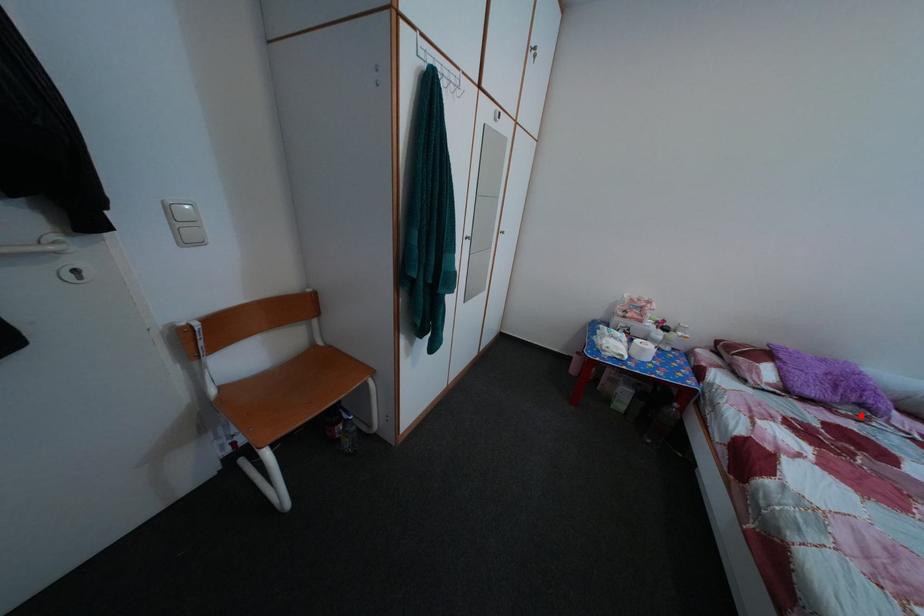
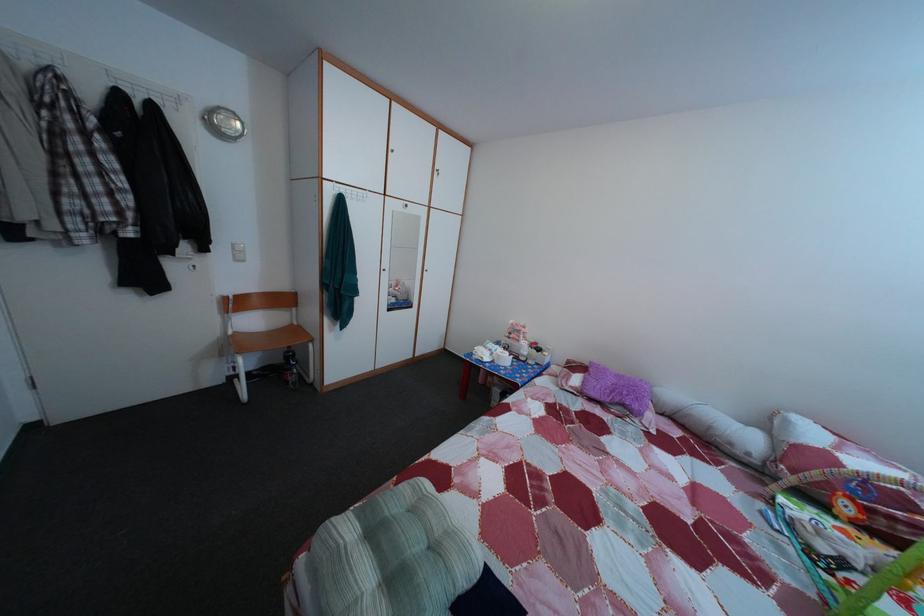
Locate, in the second image, the point that corresponds to the highlighted location in the first image.

(628, 416)